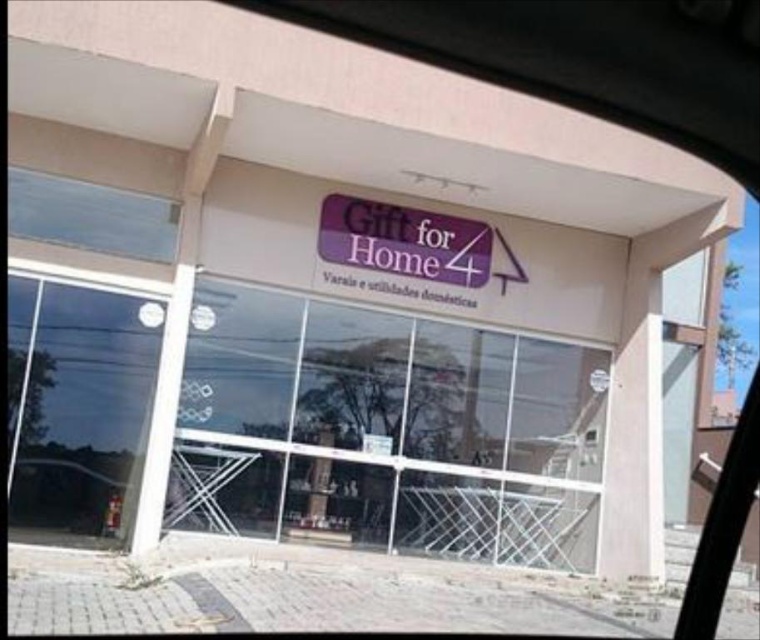
Question: Is transparent glass at center positioned behind transparent glass door at lower left?

Choices:
 (A) no
 (B) yes

Answer: (B)

Question: Which point appears farthest from the camera in this image?

Choices:
 (A) (249, 516)
 (B) (81, 474)

Answer: (A)

Question: Does transparent glass at center appear on the left side of transparent glass door at lower left?

Choices:
 (A) yes
 (B) no

Answer: (B)

Question: From the image, what is the correct spatial relationship of transparent glass at center in relation to transparent glass door at lower left?

Choices:
 (A) right
 (B) left

Answer: (A)